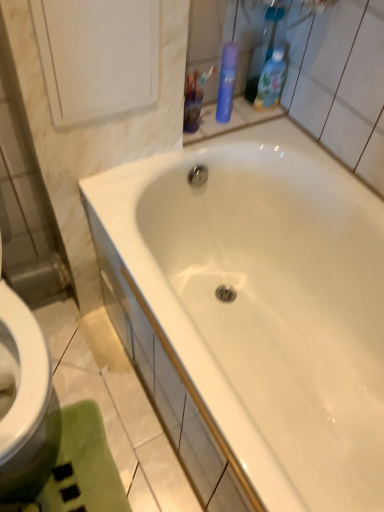
Question: From a real-world perspective, is blue glossy bottle at upper right, marked as the 2th cleaning product in a left-to-right arrangement, physically above green plush bath mat at lower left?

Choices:
 (A) yes
 (B) no

Answer: (A)

Question: Considering the relative sizes of blue glossy bottle at upper right, the 1th cleaning product when ordered from right to left, and green plush bath mat at lower left in the image provided, is blue glossy bottle at upper right, the 1th cleaning product when ordered from right to left, wider than green plush bath mat at lower left?

Choices:
 (A) no
 (B) yes

Answer: (A)

Question: Is blue glossy bottle at upper right, marked as the 2th cleaning product in a left-to-right arrangement, outside green plush bath mat at lower left?

Choices:
 (A) yes
 (B) no

Answer: (A)

Question: Considering the relative sizes of blue glossy bottle at upper right, marked as the 2th cleaning product in a left-to-right arrangement, and green plush bath mat at lower left in the image provided, is blue glossy bottle at upper right, marked as the 2th cleaning product in a left-to-right arrangement, bigger than green plush bath mat at lower left?

Choices:
 (A) yes
 (B) no

Answer: (B)

Question: Is blue glossy bottle at upper right, the 1th cleaning product when ordered from right to left, looking in the opposite direction of green plush bath mat at lower left?

Choices:
 (A) no
 (B) yes

Answer: (A)

Question: Is blue glossy bottle at upper right, the 1th cleaning product when ordered from right to left, closer to the viewer compared to green plush bath mat at lower left?

Choices:
 (A) yes
 (B) no

Answer: (B)

Question: From a real-world perspective, is translucent plastic cup at upper center below green plush bath mat at lower left?

Choices:
 (A) yes
 (B) no

Answer: (B)

Question: Is translucent plastic cup at upper center further to camera compared to green plush bath mat at lower left?

Choices:
 (A) no
 (B) yes

Answer: (B)

Question: Does translucent plastic cup at upper center have a greater width compared to green plush bath mat at lower left?

Choices:
 (A) no
 (B) yes

Answer: (A)

Question: Is translucent plastic cup at upper center at the right side of green plush bath mat at lower left?

Choices:
 (A) yes
 (B) no

Answer: (A)

Question: Does translucent plastic cup at upper center have a lesser width compared to green plush bath mat at lower left?

Choices:
 (A) no
 (B) yes

Answer: (B)

Question: Is green plush bath mat at lower left located within translucent plastic cup at upper center?

Choices:
 (A) yes
 (B) no

Answer: (B)

Question: From a real-world perspective, is blue matte spray can at upper right, marked as the first cleaning product in a left-to-right arrangement, beneath translucent plastic cup at upper center?

Choices:
 (A) no
 (B) yes

Answer: (A)